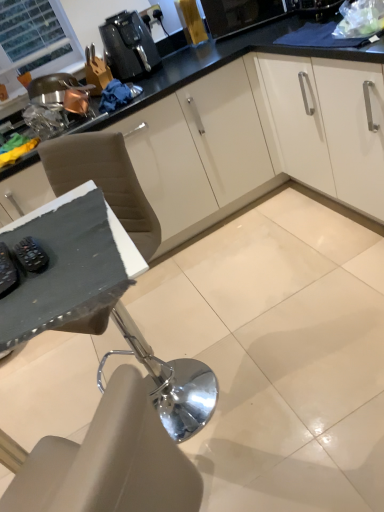
Locate an element on the screen. black rubber remote control at left, which is the 1th appliance from right to left is located at coordinates (31, 255).

This screenshot has height=512, width=384. I want to click on black rubber remote control at left, the second appliance in the left-to-right sequence, so click(x=31, y=255).

Consider the image. Is black rubber remote control at lower left, which appears as the 2th appliance when viewed from the right, turned away from black rubber remote control at left, which is the 1th appliance from right to left?

Yes, black rubber remote control at lower left, which appears as the 2th appliance when viewed from the right,'s orientation is away from black rubber remote control at left, which is the 1th appliance from right to left.

In terms of width, does black rubber remote control at lower left, which appears as the 2th appliance when viewed from the right, look wider or thinner when compared to black rubber remote control at left, the second appliance in the left-to-right sequence?

Considering their sizes, black rubber remote control at lower left, which appears as the 2th appliance when viewed from the right, looks broader than black rubber remote control at left, the second appliance in the left-to-right sequence.

Considering the relative sizes of black rubber remote control at lower left, the first appliance viewed from the left, and black rubber remote control at left, the second appliance in the left-to-right sequence, in the image provided, is black rubber remote control at lower left, the first appliance viewed from the left, taller than black rubber remote control at left, the second appliance in the left-to-right sequence,?

Indeed, black rubber remote control at lower left, the first appliance viewed from the left, has a greater height compared to black rubber remote control at left, the second appliance in the left-to-right sequence.

Can black rubber remote control at left, which is the 1th appliance from right to left, be found inside black rubber remote control at lower left, which appears as the 2th appliance when viewed from the right?

That's incorrect, black rubber remote control at left, which is the 1th appliance from right to left, is not inside black rubber remote control at lower left, which appears as the 2th appliance when viewed from the right.

Considering the positions of point (142, 74) and point (16, 248), is point (142, 74) closer or farther from the camera than point (16, 248)?

Point (142, 74).

Between black plastic coffee machine at upper center and black rubber remote control at left, the second appliance in the left-to-right sequence, which one appears on the right side from the viewer's perspective?

black rubber remote control at left, the second appliance in the left-to-right sequence, is more to the right.

Who is shorter, black plastic coffee machine at upper center or black rubber remote control at lower left, the first appliance viewed from the left?

Standing shorter between the two is black rubber remote control at lower left, the first appliance viewed from the left.

Which object is closer to the camera taking this photo, black plastic coffee machine at upper center or black rubber remote control at lower left, the first appliance viewed from the left?

Positioned in front is black rubber remote control at lower left, the first appliance viewed from the left.

How many degrees apart are the facing directions of black plastic coffee machine at upper center and black rubber remote control at lower left, the first appliance viewed from the left?

The facing directions of black plastic coffee machine at upper center and black rubber remote control at lower left, the first appliance viewed from the left, are 87.3 degrees apart.

From a real-world perspective, which object stands above the other?

black plastic coffee machine at upper center is physically above.

Based on the photo, is black rubber remote control at lower left, which appears as the 2th appliance when viewed from the right, wider than black plastic coffee machine at upper center?

No.

Is black rubber remote control at lower left, the first appliance viewed from the left, inside or outside of black plastic coffee machine at upper center?

black rubber remote control at lower left, the first appliance viewed from the left, is located beyond the bounds of black plastic coffee machine at upper center.

Is the depth of black rubber remote control at lower left, which appears as the 2th appliance when viewed from the right, less than that of black plastic coffee machine at upper center?

Yes, it is.

Is black rubber remote control at lower left, which appears as the 2th appliance when viewed from the right, next to black plastic coffee machine at upper center and touching it?

No.

Between black rubber remote control at left, which is the 1th appliance from right to left, and black plastic coffee machine at upper center, which one has more height?

black plastic coffee machine at upper center is taller.

From the image's perspective, is black rubber remote control at left, which is the 1th appliance from right to left, on top of black plastic coffee machine at upper center?

No.

Is black rubber remote control at left, the second appliance in the left-to-right sequence, in front of black plastic coffee machine at upper center?

Yes, black rubber remote control at left, the second appliance in the left-to-right sequence, is in front of black plastic coffee machine at upper center.

Based on the photo, considering the relative sizes of black rubber remote control at left, which is the 1th appliance from right to left, and black rubber remote control at lower left, the first appliance viewed from the left, in the image provided, is black rubber remote control at left, which is the 1th appliance from right to left, taller than black rubber remote control at lower left, the first appliance viewed from the left,?

Incorrect, the height of black rubber remote control at left, which is the 1th appliance from right to left, is not larger of that of black rubber remote control at lower left, the first appliance viewed from the left.

Measure the distance between black rubber remote control at left, the second appliance in the left-to-right sequence, and black rubber remote control at lower left, the first appliance viewed from the left.

black rubber remote control at left, the second appliance in the left-to-right sequence, is 4.24 centimeters away from black rubber remote control at lower left, the first appliance viewed from the left.

Is black rubber remote control at left, which is the 1th appliance from right to left, aimed at black rubber remote control at lower left, which appears as the 2th appliance when viewed from the right?

Yes, black rubber remote control at left, which is the 1th appliance from right to left, is aimed at black rubber remote control at lower left, which appears as the 2th appliance when viewed from the right.

You are a GUI agent. You are given a task and a screenshot of the screen. Output one action in this format:
    pyautogui.click(x=<x>, y=<y>)
    Task: Click on the appliance on the right of black rubber remote control at lower left, which appears as the 2th appliance when viewed from the right
    The height and width of the screenshot is (512, 384).
    Given the screenshot: What is the action you would take?
    pyautogui.click(x=31, y=255)

You are a GUI agent. You are given a task and a screenshot of the screen. Output one action in this format:
    pyautogui.click(x=<x>, y=<y>)
    Task: Click on the appliance above the black rubber remote control at lower left, the first appliance viewed from the left (from the image's perspective)
    The image size is (384, 512).
    Given the screenshot: What is the action you would take?
    pyautogui.click(x=31, y=255)

Where is `the 2nd appliance directly beneath the black plastic coffee machine at upper center (from a real-world perspective)`? the 2nd appliance directly beneath the black plastic coffee machine at upper center (from a real-world perspective) is located at coordinates (31, 255).

From the image, which object appears to be nearer to black rubber remote control at left, the second appliance in the left-to-right sequence, black rubber remote control at lower left, which appears as the 2th appliance when viewed from the right, or black plastic coffee machine at upper center?

Based on the image, black rubber remote control at lower left, which appears as the 2th appliance when viewed from the right, appears to be nearer to black rubber remote control at left, the second appliance in the left-to-right sequence.

Estimate the real-world distances between objects in this image. Which object is further from black plastic coffee machine at upper center, black rubber remote control at left, which is the 1th appliance from right to left, or black rubber remote control at lower left, the first appliance viewed from the left?

The object further to black plastic coffee machine at upper center is black rubber remote control at lower left, the first appliance viewed from the left.

Based on their spatial positions, is black rubber remote control at lower left, the first appliance viewed from the left, or black rubber remote control at left, the second appliance in the left-to-right sequence, further from black plastic coffee machine at upper center?

black rubber remote control at lower left, the first appliance viewed from the left, is positioned further to the anchor black plastic coffee machine at upper center.

Looking at the image, which one is located closer to black rubber remote control at left, the second appliance in the left-to-right sequence, black plastic coffee machine at upper center or black rubber remote control at lower left, the first appliance viewed from the left?

black rubber remote control at lower left, the first appliance viewed from the left, lies closer to black rubber remote control at left, the second appliance in the left-to-right sequence, than the other object.

Considering their positions, is black rubber remote control at left, the second appliance in the left-to-right sequence, positioned closer to black rubber remote control at lower left, the first appliance viewed from the left, than black plastic coffee machine at upper center?

black rubber remote control at left, the second appliance in the left-to-right sequence.

From the picture: Based on their spatial positions, is black plastic coffee machine at upper center or black rubber remote control at left, which is the 1th appliance from right to left, further from black rubber remote control at lower left, the first appliance viewed from the left?

black plastic coffee machine at upper center lies further to black rubber remote control at lower left, the first appliance viewed from the left, than the other object.

Identify the location of appliance between black rubber remote control at lower left, the first appliance viewed from the left, and black plastic coffee machine at upper center, along the z-axis. The width and height of the screenshot is (384, 512). [31, 255].